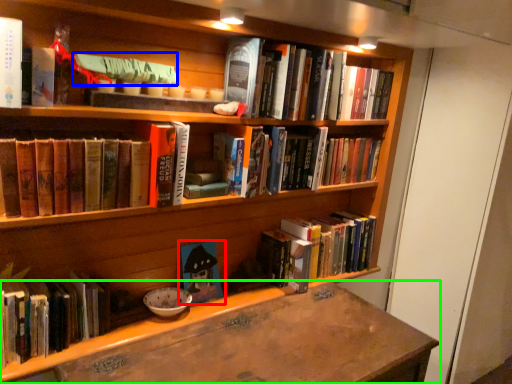
Question: Estimate the real-world distances between objects in this image. Which object is farther from book (highlighted by a red box), book (highlighted by a blue box) or desk (highlighted by a green box)?

Choices:
 (A) book
 (B) desk

Answer: (A)